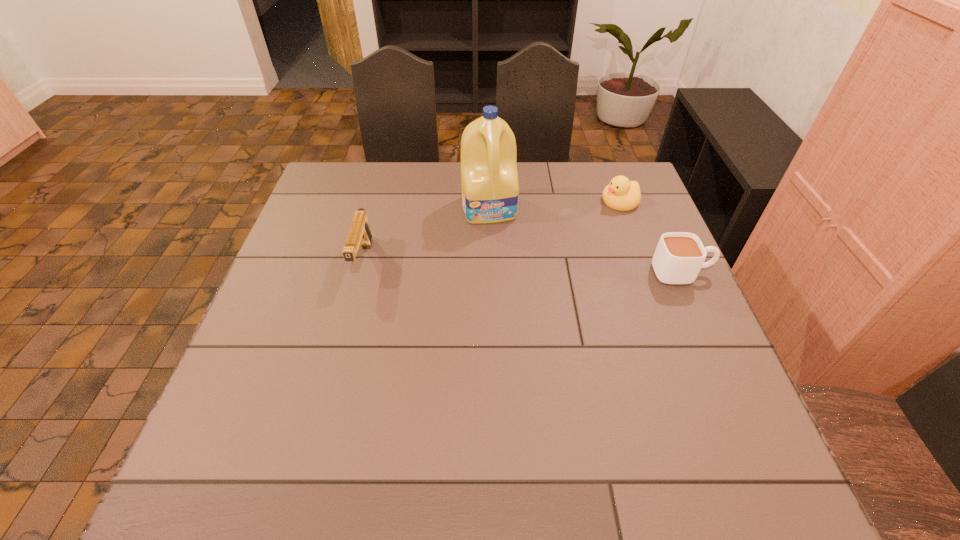
I want to click on blank area at the left edge, so click(317, 222).

In the image, there is a desktop. Identify the location of blank space at the right edge. The width and height of the screenshot is (960, 540). (670, 384).

The image size is (960, 540). In order to click on vacant space at the far left corner in this screenshot , I will do `click(352, 172)`.

Identify the location of vacant space that's between the tallest object and the pistol. The height and width of the screenshot is (540, 960). (426, 234).

Where is `free spot between the duckling and the detergent`? This screenshot has width=960, height=540. free spot between the duckling and the detergent is located at coordinates (555, 205).

This screenshot has width=960, height=540. I want to click on unoccupied position between the pistol and the tallest object, so click(426, 234).

I want to click on vacant region between the pistol and the detergent, so click(x=426, y=234).

This screenshot has width=960, height=540. I want to click on vacant space in between the cup and the detergent, so (x=586, y=240).

Where is `free space that is in between the cup and the duckling`? free space that is in between the cup and the duckling is located at coordinates (651, 237).

You are a GUI agent. You are given a task and a screenshot of the screen. Output one action in this format:
    pyautogui.click(x=<x>, y=<y>)
    Task: Click on the free spot between the cup and the third shortest object
    
    Given the screenshot: What is the action you would take?
    pyautogui.click(x=522, y=267)